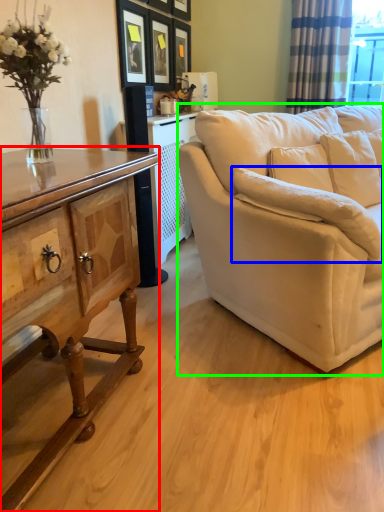
Question: Based on their relative distances, which object is nearer to cabinetry (highlighted by a red box)? Choose from pillow (highlighted by a blue box) and studio couch (highlighted by a green box).

Choices:
 (A) pillow
 (B) studio couch

Answer: (A)